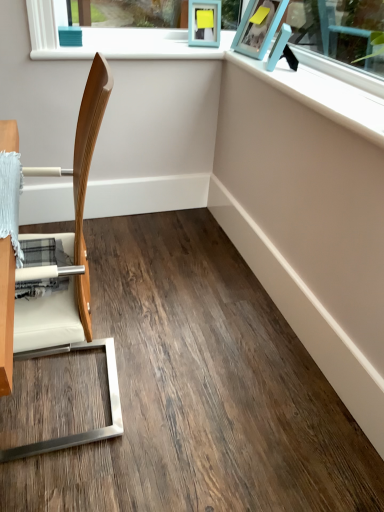
Identify the location of wooden chair at left. This screenshot has width=384, height=512. (70, 281).

Find the location of a particular element. The height and width of the screenshot is (512, 384). matte blue picture frame at upper right, marked as the third picture frame in a left-to-right arrangement is located at coordinates (282, 50).

Is matte blue picture frame at upper right, marked as the third picture frame in a left-to-right arrangement, turned away from wooden chair at left?

No, matte blue picture frame at upper right, marked as the third picture frame in a left-to-right arrangement, is not facing the opposite direction of wooden chair at left.

Is matte blue picture frame at upper right, marked as the third picture frame in a left-to-right arrangement, further to the viewer compared to wooden chair at left?

That is True.

Considering the sizes of matte blue picture frame at upper right, marked as the third picture frame in a left-to-right arrangement, and wooden chair at left in the image, is matte blue picture frame at upper right, marked as the third picture frame in a left-to-right arrangement, bigger or smaller than wooden chair at left?

Clearly, matte blue picture frame at upper right, marked as the third picture frame in a left-to-right arrangement, is smaller in size than wooden chair at left.

From a real-world perspective, is teal matte picture frame at upper center, the first picture frame when ordered from left to right, on matte blue picture frame at upper right, marked as the first picture frame in a right-to-left arrangement?

Correct, in the physical world, teal matte picture frame at upper center, the first picture frame when ordered from left to right, is higher than matte blue picture frame at upper right, marked as the first picture frame in a right-to-left arrangement.

Would you say teal matte picture frame at upper center, the first picture frame when ordered from left to right, is to the left or to the right of matte blue picture frame at upper right, marked as the first picture frame in a right-to-left arrangement, in the picture?

teal matte picture frame at upper center, the first picture frame when ordered from left to right, is positioned on matte blue picture frame at upper right, marked as the first picture frame in a right-to-left arrangement,'s left side.

Would you consider teal matte picture frame at upper center, the first picture frame when ordered from left to right, to be distant from matte blue picture frame at upper right, marked as the first picture frame in a right-to-left arrangement?

They are positioned close to each other.

From the image's perspective, is teal matte picture frame at upper center, the first picture frame when ordered from left to right, on top of matte blue picture frame at upper right, marked as the third picture frame in a left-to-right arrangement?

Yes, from the image's perspective, teal matte picture frame at upper center, the first picture frame when ordered from left to right, is on top of matte blue picture frame at upper right, marked as the third picture frame in a left-to-right arrangement.

How much distance is there between wooden chair at left and matte blue picture frame at upper right, marked as the third picture frame in a left-to-right arrangement?

They are 3.91 feet apart.

From their relative heights in the image, would you say wooden chair at left is taller or shorter than matte blue picture frame at upper right, marked as the first picture frame in a right-to-left arrangement?

In the image, wooden chair at left appears to be taller than matte blue picture frame at upper right, marked as the first picture frame in a right-to-left arrangement.

Would you say wooden chair at left is to the left or to the right of matte blue picture frame at upper right, marked as the first picture frame in a right-to-left arrangement, in the picture?

wooden chair at left is to the left of matte blue picture frame at upper right, marked as the first picture frame in a right-to-left arrangement.

Is point (283, 44) closer or farther from the camera than point (257, 51)?

Point (283, 44).

From the picture: In terms of width, does matte blue picture frame at upper right, marked as the first picture frame in a right-to-left arrangement, look wider or thinner when compared to blue plastic picture frame at upper right, the 2th picture frame positioned from the right?

In the image, matte blue picture frame at upper right, marked as the first picture frame in a right-to-left arrangement, appears to be wider than blue plastic picture frame at upper right, the 2th picture frame positioned from the right.

How much distance is there between matte blue picture frame at upper right, marked as the third picture frame in a left-to-right arrangement, and blue plastic picture frame at upper right, the 2th picture frame positioned from the right?

A distance of 4.13 inches exists between matte blue picture frame at upper right, marked as the third picture frame in a left-to-right arrangement, and blue plastic picture frame at upper right, the 2th picture frame positioned from the right.

Is teal matte picture frame at upper center, the first picture frame when ordered from left to right, not near wooden chair at left?

Yes, teal matte picture frame at upper center, the first picture frame when ordered from left to right, and wooden chair at left are located far from each other.

Considering their positions, is teal matte picture frame at upper center, the first picture frame when ordered from left to right, located in front of or behind wooden chair at left?

teal matte picture frame at upper center, the first picture frame when ordered from left to right, is positioned farther from the viewer than wooden chair at left.

Based on their sizes in the image, would you say teal matte picture frame at upper center, the first picture frame when ordered from left to right, is bigger or smaller than wooden chair at left?

teal matte picture frame at upper center, the first picture frame when ordered from left to right, is smaller than wooden chair at left.

Is there a large distance between blue plastic picture frame at upper right, the second picture frame in the left-to-right sequence, and matte blue picture frame at upper right, marked as the first picture frame in a right-to-left arrangement?

No, there isn't a large distance between blue plastic picture frame at upper right, the second picture frame in the left-to-right sequence, and matte blue picture frame at upper right, marked as the first picture frame in a right-to-left arrangement.

Looking at this image, can you tell me how much blue plastic picture frame at upper right, the 2th picture frame positioned from the right, and matte blue picture frame at upper right, marked as the first picture frame in a right-to-left arrangement, differ in facing direction?

The angle between the facing direction of blue plastic picture frame at upper right, the 2th picture frame positioned from the right, and the facing direction of matte blue picture frame at upper right, marked as the first picture frame in a right-to-left arrangement, is 36.7 degrees.

Starting from the matte blue picture frame at upper right, marked as the first picture frame in a right-to-left arrangement, which picture frame is the 1st one behind? Please provide its 2D coordinates.

[(258, 27)]

Considering the sizes of blue plastic picture frame at upper right, the 2th picture frame positioned from the right, and matte blue picture frame at upper right, marked as the third picture frame in a left-to-right arrangement, in the image, is blue plastic picture frame at upper right, the 2th picture frame positioned from the right, bigger or smaller than matte blue picture frame at upper right, marked as the third picture frame in a left-to-right arrangement,?

In the image, blue plastic picture frame at upper right, the 2th picture frame positioned from the right, appears to be larger than matte blue picture frame at upper right, marked as the third picture frame in a left-to-right arrangement.

Starting from the teal matte picture frame at upper center, the first picture frame when ordered from left to right, which picture frame is the 1st one to the right? Please provide its 2D coordinates.

[(258, 27)]

Is teal matte picture frame at upper center, the first picture frame when ordered from left to right, wider or thinner than blue plastic picture frame at upper right, the second picture frame in the left-to-right sequence?

teal matte picture frame at upper center, the first picture frame when ordered from left to right, is thinner than blue plastic picture frame at upper right, the second picture frame in the left-to-right sequence.

Which object is positioned more to the left, teal matte picture frame at upper center, the first picture frame when ordered from left to right, or blue plastic picture frame at upper right, the 2th picture frame positioned from the right?

Positioned to the left is teal matte picture frame at upper center, the first picture frame when ordered from left to right.

I want to click on the 1st picture frame positioned above the wooden chair at left (from the image's perspective), so click(282, 50).

I want to click on the 2nd picture frame to the right of the teal matte picture frame at upper center, the first picture frame when ordered from left to right, starting your count from the anchor, so click(282, 50).

From the image, which object appears to be farther from blue plastic picture frame at upper right, the second picture frame in the left-to-right sequence, matte blue picture frame at upper right, marked as the third picture frame in a left-to-right arrangement, or teal matte picture frame at upper center, which is the 3th picture frame in right-to-left order?

The object further to blue plastic picture frame at upper right, the second picture frame in the left-to-right sequence, is teal matte picture frame at upper center, which is the 3th picture frame in right-to-left order.

Considering their positions, is wooden chair at left positioned further to teal matte picture frame at upper center, which is the 3th picture frame in right-to-left order, than blue plastic picture frame at upper right, the 2th picture frame positioned from the right?

Based on the image, wooden chair at left appears to be further to teal matte picture frame at upper center, which is the 3th picture frame in right-to-left order.

When comparing their distances from matte blue picture frame at upper right, marked as the third picture frame in a left-to-right arrangement, does wooden chair at left or blue plastic picture frame at upper right, the second picture frame in the left-to-right sequence, seem further?

wooden chair at left lies further to matte blue picture frame at upper right, marked as the third picture frame in a left-to-right arrangement, than the other object.

Estimate the real-world distances between objects in this image. Which object is further from teal matte picture frame at upper center, which is the 3th picture frame in right-to-left order, matte blue picture frame at upper right, marked as the third picture frame in a left-to-right arrangement, or wooden chair at left?

wooden chair at left is positioned further to the anchor teal matte picture frame at upper center, which is the 3th picture frame in right-to-left order.

Considering their positions, is matte blue picture frame at upper right, marked as the first picture frame in a right-to-left arrangement, positioned closer to blue plastic picture frame at upper right, the 2th picture frame positioned from the right, than wooden chair at left?

Based on the image, matte blue picture frame at upper right, marked as the first picture frame in a right-to-left arrangement, appears to be nearer to blue plastic picture frame at upper right, the 2th picture frame positioned from the right.

Consider the image. Based on their spatial positions, is wooden chair at left or matte blue picture frame at upper right, marked as the third picture frame in a left-to-right arrangement, further from teal matte picture frame at upper center, which is the 3th picture frame in right-to-left order?

wooden chair at left is positioned further to the anchor teal matte picture frame at upper center, which is the 3th picture frame in right-to-left order.

Which object lies further to the anchor point wooden chair at left, matte blue picture frame at upper right, marked as the third picture frame in a left-to-right arrangement, or blue plastic picture frame at upper right, the second picture frame in the left-to-right sequence?

blue plastic picture frame at upper right, the second picture frame in the left-to-right sequence.

Looking at the image, which one is located closer to matte blue picture frame at upper right, marked as the first picture frame in a right-to-left arrangement, teal matte picture frame at upper center, which is the 3th picture frame in right-to-left order, or wooden chair at left?

teal matte picture frame at upper center, which is the 3th picture frame in right-to-left order, is closer to matte blue picture frame at upper right, marked as the first picture frame in a right-to-left arrangement.

I want to click on picture frame located between matte blue picture frame at upper right, marked as the first picture frame in a right-to-left arrangement, and teal matte picture frame at upper center, which is the 3th picture frame in right-to-left order, in the depth direction, so click(x=258, y=27).

Locate an element on the screen. This screenshot has height=512, width=384. picture frame between wooden chair at left and blue plastic picture frame at upper right, the 2th picture frame positioned from the right, along the z-axis is located at coordinates (282, 50).